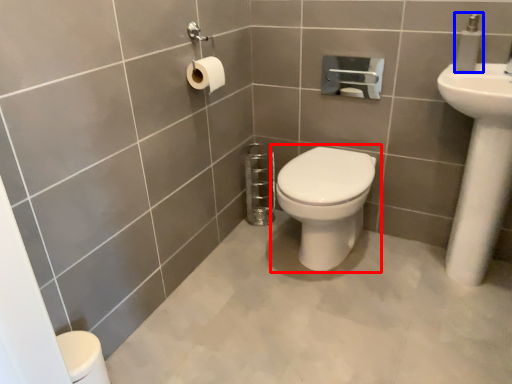
Question: Which object appears farthest to the camera in this image, toilet (highlighted by a red box) or soap dispenser (highlighted by a blue box)?

Choices:
 (A) toilet
 (B) soap dispenser

Answer: (A)